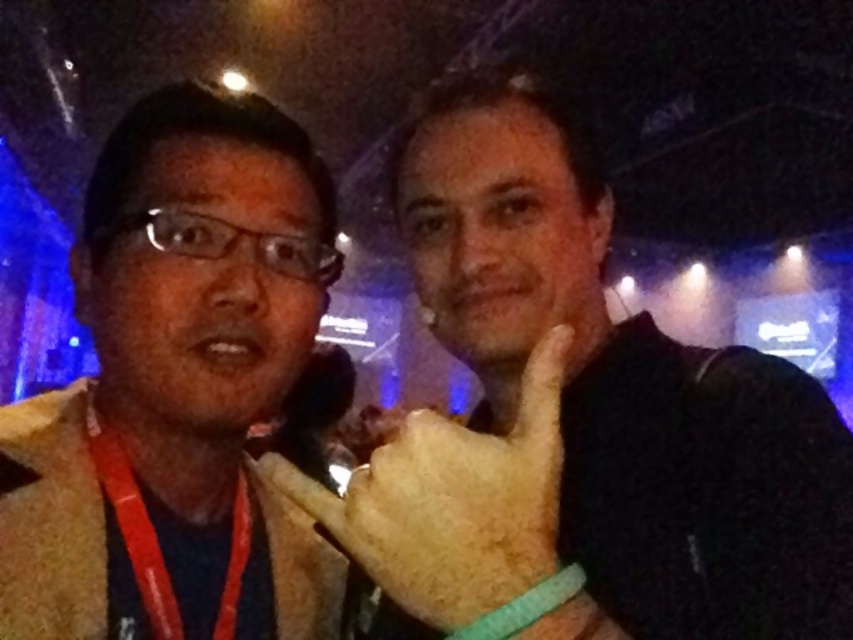
Question: Which point appears closest to the camera in this image?

Choices:
 (A) (494, 458)
 (B) (567, 182)
 (C) (109, 458)
 (D) (91, 618)

Answer: (A)

Question: Is smooth beige sweater at left behind dry skin at center?

Choices:
 (A) yes
 (B) no

Answer: (B)

Question: Which point is farther from the camera taking this photo?

Choices:
 (A) (550, 525)
 (B) (236, 506)
 (C) (233, 570)
 (D) (467, 204)

Answer: (B)

Question: Which object is closer to the camera taking this photo?

Choices:
 (A) fuzzy beige glove at center
 (B) smooth beige sweater at left
 (C) beige woolen coat at left
 (D) dry skin at center

Answer: (A)

Question: Considering the relative positions of smooth beige sweater at left and red lanyard at left in the image provided, where is smooth beige sweater at left located with respect to red lanyard at left?

Choices:
 (A) right
 (B) left

Answer: (A)

Question: Can you confirm if fuzzy beige glove at center is wider than dry skin at center?

Choices:
 (A) no
 (B) yes

Answer: (B)